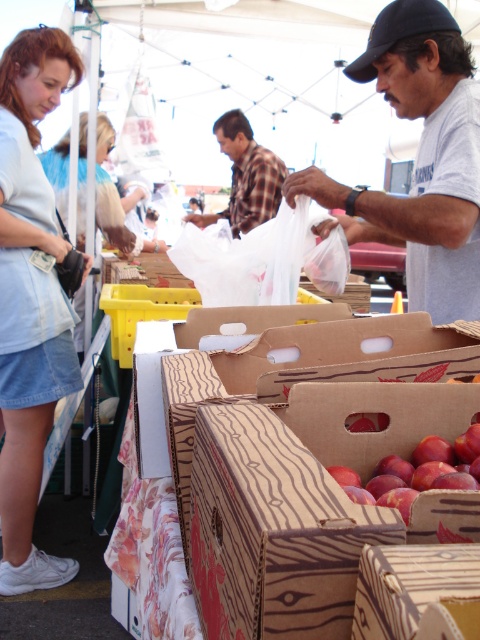
You are a customer at the market and want to know if the wooden crate of apples at center is easier to carry than the plaid fabric shirt at center. Based on their thickness, which one is thinner?

The wooden crate of apples at center is thinner than the plaid fabric shirt at center, so it would be easier to carry.